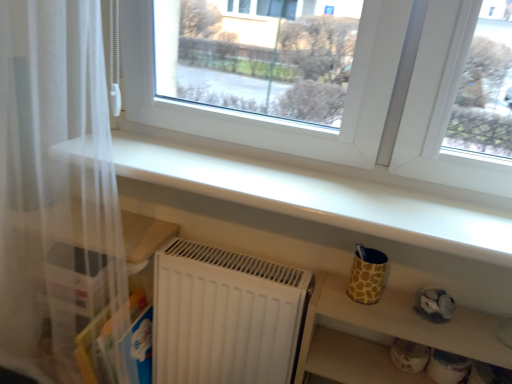
The height and width of the screenshot is (384, 512). Describe the element at coordinates (414, 322) in the screenshot. I see `matte yellow cup at lower right, which is the 2th shelf from top to bottom` at that location.

You are a GUI agent. You are given a task and a screenshot of the screen. Output one action in this format:
    pyautogui.click(x=<x>, y=<y>)
    Task: Click on the matte yellow cup at lower right, which is the 2th shelf from top to bottom
    Image resolution: width=512 pixels, height=384 pixels.
    Given the screenshot: What is the action you would take?
    pyautogui.click(x=414, y=322)

Looking at their sizes, would you say matte yellow cup at lower right, the 1th shelf ordered from the bottom, is wider or thinner than white sheer curtain at left?

matte yellow cup at lower right, the 1th shelf ordered from the bottom, is thinner than white sheer curtain at left.

Based on their positions, is matte yellow cup at lower right, which is the 2th shelf from top to bottom, located to the left or right of white sheer curtain at left?

From the image, it's evident that matte yellow cup at lower right, which is the 2th shelf from top to bottom, is to the right of white sheer curtain at left.

Is matte yellow cup at lower right, which is the 2th shelf from top to bottom, far from white sheer curtain at left?

That's not correct — matte yellow cup at lower right, which is the 2th shelf from top to bottom, is a little close to white sheer curtain at left.

Who is bigger, matte yellow cup at lower right, which is the 2th shelf from top to bottom, or white sheer curtain at left?

white sheer curtain at left is bigger.

Is white sheer curtain at left facing towards matte yellow cup at lower right, the 1th shelf ordered from the bottom?

No, white sheer curtain at left is not aimed at matte yellow cup at lower right, the 1th shelf ordered from the bottom.

Looking at the image, does white sheer curtain at left seem bigger or smaller compared to matte yellow cup at lower right, which is the 2th shelf from top to bottom?

In the image, white sheer curtain at left appears to be larger than matte yellow cup at lower right, which is the 2th shelf from top to bottom.

Between white sheer curtain at left and matte yellow cup at lower right, which is the 2th shelf from top to bottom, which one appears on the right side from the viewer's perspective?

matte yellow cup at lower right, which is the 2th shelf from top to bottom.

Can you confirm if white sheer curtain at left is thinner than matte yellow cup at lower right, which is the 2th shelf from top to bottom?

In fact, white sheer curtain at left might be wider than matte yellow cup at lower right, which is the 2th shelf from top to bottom.

Which object is further away from the camera, white sheer curtain at left or white glossy shelf at upper center, which appears as the 2th shelf when ordered from the bottom?

white sheer curtain at left is behind.

Which is farther, (23, 220) or (485, 360)?

The point (23, 220) is farther.

Is white sheer curtain at left not close to white glossy shelf at upper center, the 1th shelf in the top-to-bottom sequence?

No, white sheer curtain at left is in close proximity to white glossy shelf at upper center, the 1th shelf in the top-to-bottom sequence.

Can you confirm if white sheer curtain at left is wider than white glossy shelf at upper center, which appears as the 2th shelf when ordered from the bottom?

In fact, white sheer curtain at left might be narrower than white glossy shelf at upper center, which appears as the 2th shelf when ordered from the bottom.

Are white glossy shelf at upper center, the 1th shelf in the top-to-bottom sequence, and white sheer curtain at left far apart?

No, white glossy shelf at upper center, the 1th shelf in the top-to-bottom sequence, is in close proximity to white sheer curtain at left.

Does white glossy shelf at upper center, the 1th shelf in the top-to-bottom sequence, come behind white sheer curtain at left?

No, white glossy shelf at upper center, the 1th shelf in the top-to-bottom sequence, is closer to the viewer.

You are a GUI agent. You are given a task and a screenshot of the screen. Output one action in this format:
    pyautogui.click(x=<x>, y=<y>)
    Task: Click on the shelf that is under the white glossy shelf at upper center, which appears as the 2th shelf when ordered from the bottom (from a real-world perspective)
    The image size is (512, 384).
    Given the screenshot: What is the action you would take?
    pyautogui.click(x=414, y=322)

Can you confirm if white glossy shelf at upper center, which appears as the 2th shelf when ordered from the bottom, is taller than matte yellow cup at lower right, the 1th shelf ordered from the bottom?

Incorrect, the height of white glossy shelf at upper center, which appears as the 2th shelf when ordered from the bottom, is not larger of that of matte yellow cup at lower right, the 1th shelf ordered from the bottom.

Which object is positioned more to the left, white glossy shelf at upper center, the 1th shelf in the top-to-bottom sequence, or matte yellow cup at lower right, the 1th shelf ordered from the bottom?

white glossy shelf at upper center, the 1th shelf in the top-to-bottom sequence.

Is white glossy shelf at upper center, the 1th shelf in the top-to-bottom sequence, aimed at matte yellow cup at lower right, which is the 2th shelf from top to bottom?

No, white glossy shelf at upper center, the 1th shelf in the top-to-bottom sequence, is not turned towards matte yellow cup at lower right, which is the 2th shelf from top to bottom.

Choose the correct answer: Is matte yellow cup at lower right, which is the 2th shelf from top to bottom, inside white glossy shelf at upper center, which appears as the 2th shelf when ordered from the bottom, or outside it?

matte yellow cup at lower right, which is the 2th shelf from top to bottom, cannot be found inside white glossy shelf at upper center, which appears as the 2th shelf when ordered from the bottom.

Considering the sizes of objects matte yellow cup at lower right, which is the 2th shelf from top to bottom, and white glossy shelf at upper center, which appears as the 2th shelf when ordered from the bottom, in the image provided, who is wider, matte yellow cup at lower right, which is the 2th shelf from top to bottom, or white glossy shelf at upper center, which appears as the 2th shelf when ordered from the bottom,?

Wider between the two is white glossy shelf at upper center, which appears as the 2th shelf when ordered from the bottom.

Could you tell me if matte yellow cup at lower right, which is the 2th shelf from top to bottom, is facing white glossy shelf at upper center, which appears as the 2th shelf when ordered from the bottom?

No, matte yellow cup at lower right, which is the 2th shelf from top to bottom, is not oriented towards white glossy shelf at upper center, which appears as the 2th shelf when ordered from the bottom.

In the scene shown: Considering the sizes of matte yellow cup at lower right, the 1th shelf ordered from the bottom, and white glossy shelf at upper center, which appears as the 2th shelf when ordered from the bottom, in the image, is matte yellow cup at lower right, the 1th shelf ordered from the bottom, bigger or smaller than white glossy shelf at upper center, which appears as the 2th shelf when ordered from the bottom,?

In the image, matte yellow cup at lower right, the 1th shelf ordered from the bottom, appears to be larger than white glossy shelf at upper center, which appears as the 2th shelf when ordered from the bottom.

This screenshot has height=384, width=512. I want to click on curtain above the matte yellow cup at lower right, the 1th shelf ordered from the bottom (from a real-world perspective), so click(55, 184).

Find the location of a particular element. This screenshot has width=512, height=384. the 2nd shelf to the right of the white sheer curtain at left, starting your count from the anchor is located at coordinates (414, 322).

Looking at the image, which one is located further to matte yellow cup at lower right, which is the 2th shelf from top to bottom, white glossy shelf at upper center, the 1th shelf in the top-to-bottom sequence, or white sheer curtain at left?

Based on the image, white sheer curtain at left appears to be further to matte yellow cup at lower right, which is the 2th shelf from top to bottom.

Which object lies further to the anchor point white glossy shelf at upper center, the 1th shelf in the top-to-bottom sequence, white sheer curtain at left or matte yellow cup at lower right, which is the 2th shelf from top to bottom?

white sheer curtain at left is further to white glossy shelf at upper center, the 1th shelf in the top-to-bottom sequence.

Looking at the image, which one is located closer to white sheer curtain at left, matte yellow cup at lower right, the 1th shelf ordered from the bottom, or white glossy shelf at upper center, the 1th shelf in the top-to-bottom sequence?

The object closer to white sheer curtain at left is white glossy shelf at upper center, the 1th shelf in the top-to-bottom sequence.

Considering their positions, is matte yellow cup at lower right, which is the 2th shelf from top to bottom, positioned closer to white glossy shelf at upper center, which appears as the 2th shelf when ordered from the bottom, than white sheer curtain at left?

Based on the image, matte yellow cup at lower right, which is the 2th shelf from top to bottom, appears to be nearer to white glossy shelf at upper center, which appears as the 2th shelf when ordered from the bottom.

Based on their spatial positions, is white glossy shelf at upper center, which appears as the 2th shelf when ordered from the bottom, or matte yellow cup at lower right, the 1th shelf ordered from the bottom, closer to white sheer curtain at left?

The object closer to white sheer curtain at left is white glossy shelf at upper center, which appears as the 2th shelf when ordered from the bottom.

From the image, which object appears to be nearer to matte yellow cup at lower right, the 1th shelf ordered from the bottom, white sheer curtain at left or white glossy shelf at upper center, which appears as the 2th shelf when ordered from the bottom?

white glossy shelf at upper center, which appears as the 2th shelf when ordered from the bottom, is positioned closer to the anchor matte yellow cup at lower right, the 1th shelf ordered from the bottom.

You are a GUI agent. You are given a task and a screenshot of the screen. Output one action in this format:
    pyautogui.click(x=<x>, y=<y>)
    Task: Click on the shelf situated between white sheer curtain at left and matte yellow cup at lower right, the 1th shelf ordered from the bottom, from left to right
    Image resolution: width=512 pixels, height=384 pixels.
    Given the screenshot: What is the action you would take?
    pyautogui.click(x=321, y=218)